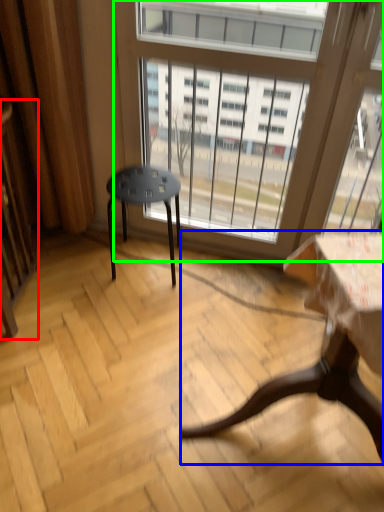
Question: Which object is positioned closest to screen door (highlighted by a red box)? Select from table (highlighted by a blue box) and window (highlighted by a green box).

Choices:
 (A) table
 (B) window

Answer: (B)